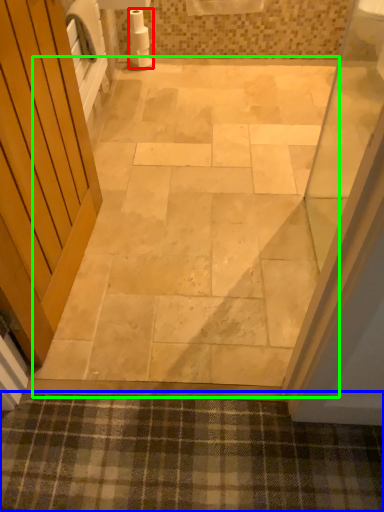
Question: Estimate the real-world distances between objects in this image. Which object is closer to toilet paper (highlighted by a red box), bath mat (highlighted by a blue box) or path (highlighted by a green box)?

Choices:
 (A) bath mat
 (B) path

Answer: (B)